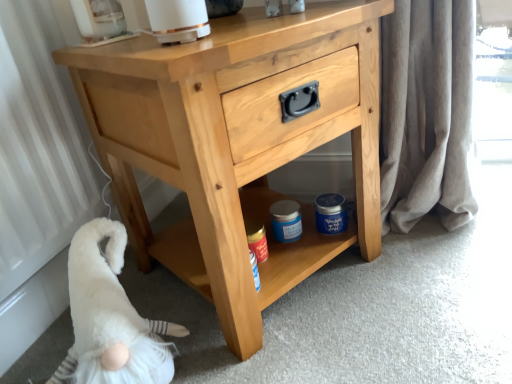
Find the location of a particular element. Image resolution: width=512 pixels, height=384 pixels. spots to the right of white fluffy gnome at lower left is located at coordinates (247, 345).